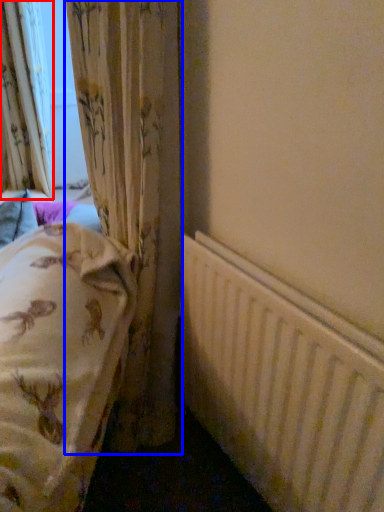
Question: Which object appears farthest to the camera in this image, curtain (highlighted by a red box) or curtain (highlighted by a blue box)?

Choices:
 (A) curtain
 (B) curtain

Answer: (A)